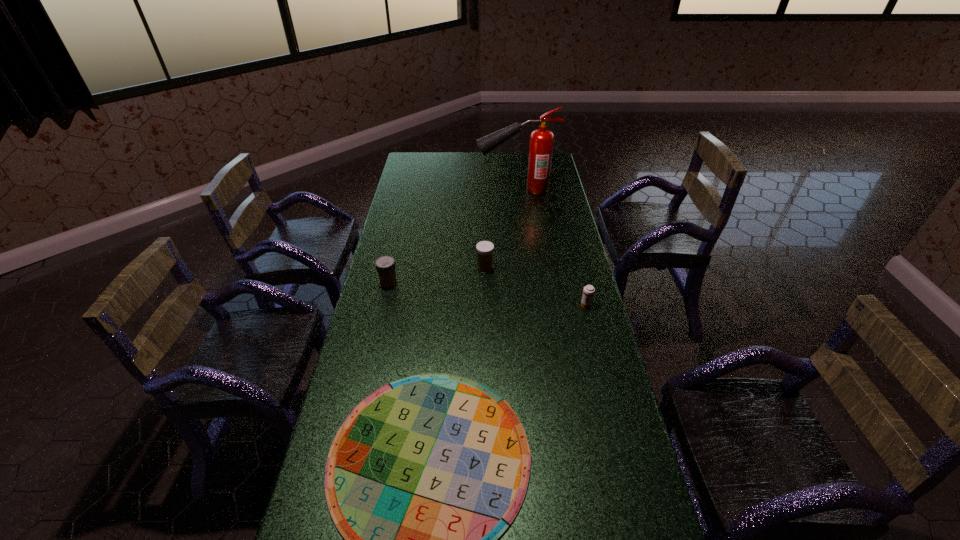
Locate an element on the screen. free spot located 0.240m at the nozzle of the farthest object is located at coordinates click(x=428, y=189).

At what (x,y) coordinates should I click in order to perform the action: click on free space located on the back of the second medicine from right to left. Please return your answer as a coordinate pair (x, y). The height and width of the screenshot is (540, 960). Looking at the image, I should click on (485, 239).

Image resolution: width=960 pixels, height=540 pixels. Find the location of `vacant space located 0.170m on the label side of the leftmost medicine`. vacant space located 0.170m on the label side of the leftmost medicine is located at coordinates (443, 284).

You are a GUI agent. You are given a task and a screenshot of the screen. Output one action in this format:
    pyautogui.click(x=<x>, y=<y>)
    Task: Click on the vacant area situated 0.320m on the left of the second shortest object
    
    Given the screenshot: What is the action you would take?
    pyautogui.click(x=491, y=305)

Identify the location of object that is at the left edge. (385, 265).

Find the location of a particular element. The height and width of the screenshot is (540, 960). fire extinguisher situated at the right edge is located at coordinates (541, 140).

The image size is (960, 540). Identify the location of medicine located in the right edge section of the desktop. (588, 292).

Identify the location of vacant space at the far edge of the desktop. Image resolution: width=960 pixels, height=540 pixels. (489, 153).

Identify the location of free space at the left edge of the desktop. This screenshot has height=540, width=960. (396, 323).

In the image, there is a desktop. Identify the location of vacant area at the right edge. The height and width of the screenshot is (540, 960). (578, 333).